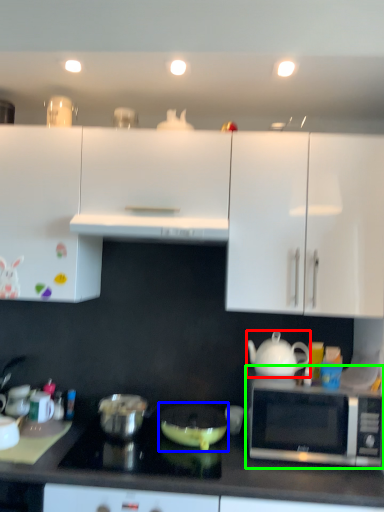
Question: Which object is the closest to the teapot (highlighted by a red box)? Choose among these: appliance (highlighted by a blue box) or microwave oven (highlighted by a green box).

Choices:
 (A) appliance
 (B) microwave oven

Answer: (B)